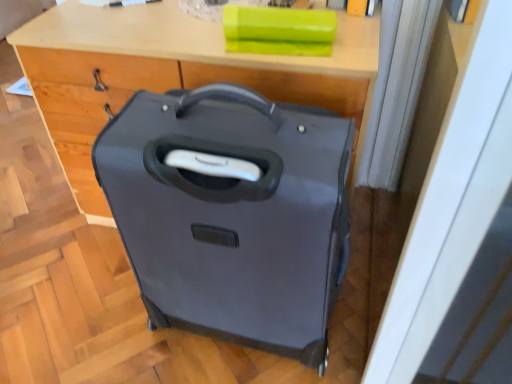
Where is `free space to the left of matte wood computer desk at center`? The image size is (512, 384). free space to the left of matte wood computer desk at center is located at coordinates (44, 222).